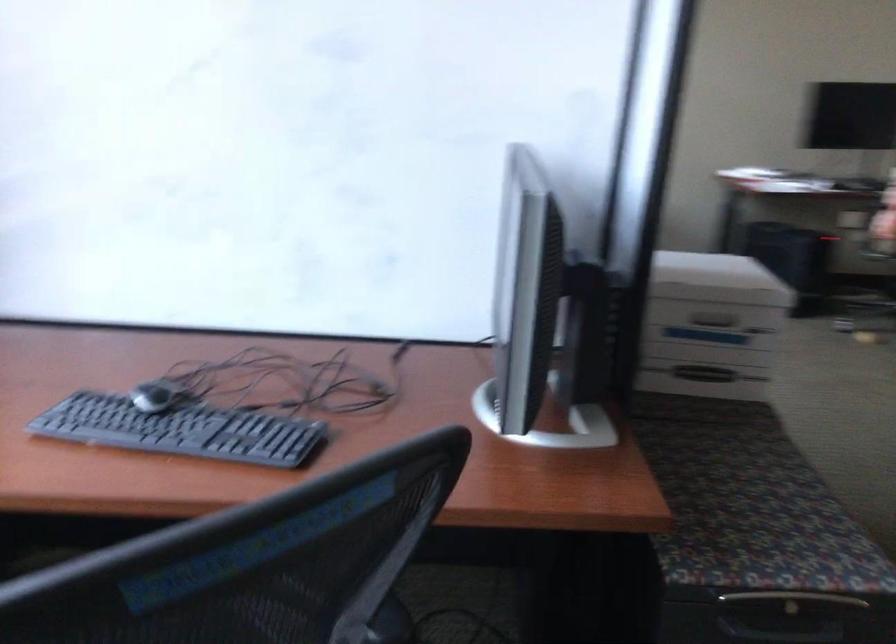
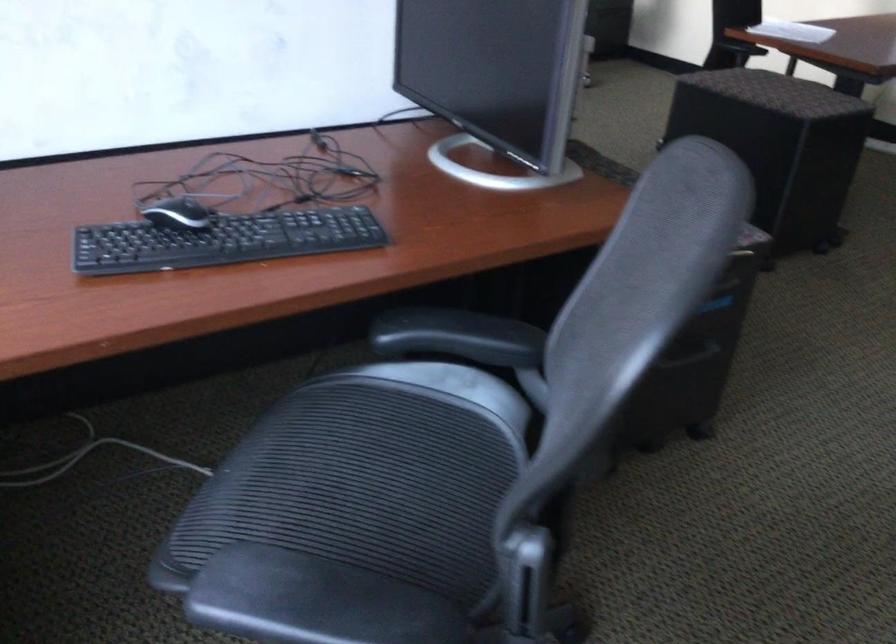
The first image is from the beginning of the video and the second image is from the end. How did the camera likely rotate when shooting the video?

The rotation direction of the camera is right-down.